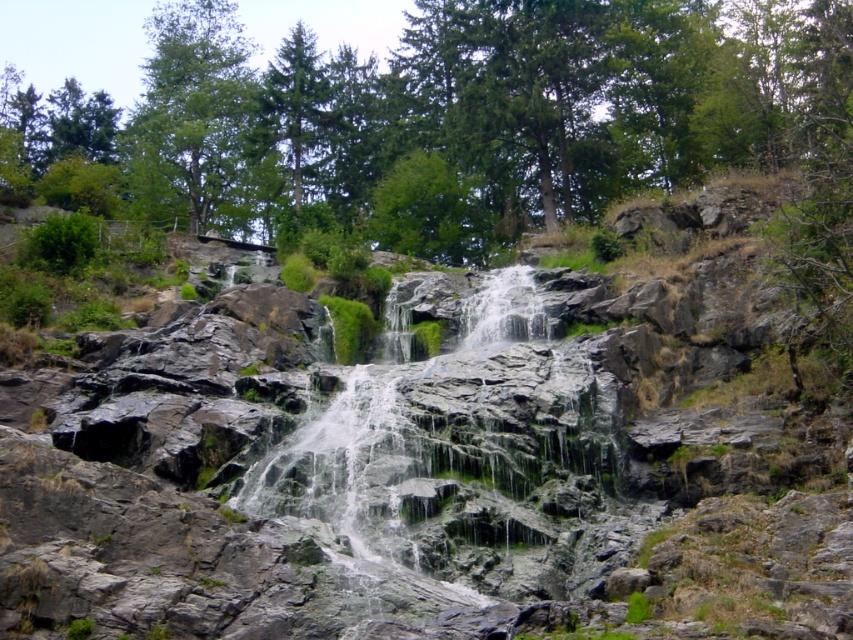
Question: Considering the real-world distances, which object is closest to the green leafy tree at upper left?

Choices:
 (A) green mossy rock at center
 (B) green mossy rocks at center

Answer: (B)

Question: Observing the image, what is the correct spatial positioning of green mossy rocks at center in reference to green leafy tree at upper left?

Choices:
 (A) below
 (B) above

Answer: (A)

Question: Among these objects, which one is farthest from the camera?

Choices:
 (A) green mossy rocks at center
 (B) green leafy tree at upper left

Answer: (B)

Question: Is the position of green mossy rocks at center less distant than that of green leafy tree at upper left?

Choices:
 (A) yes
 (B) no

Answer: (A)

Question: Which object appears farthest from the camera in this image?

Choices:
 (A) green mossy rocks at center
 (B) green mossy rock at center
 (C) green leafy tree at upper left

Answer: (C)

Question: Can you confirm if green mossy rocks at center is positioned to the right of green leafy tree at upper left?

Choices:
 (A) yes
 (B) no

Answer: (A)